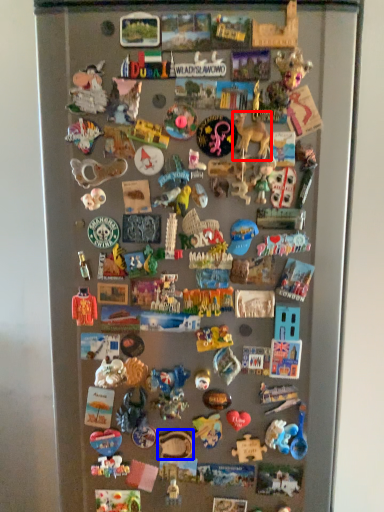
Question: Which object appears closest to the camera in this image, toy (highlighted by a red box) or toy (highlighted by a blue box)?

Choices:
 (A) toy
 (B) toy

Answer: (A)